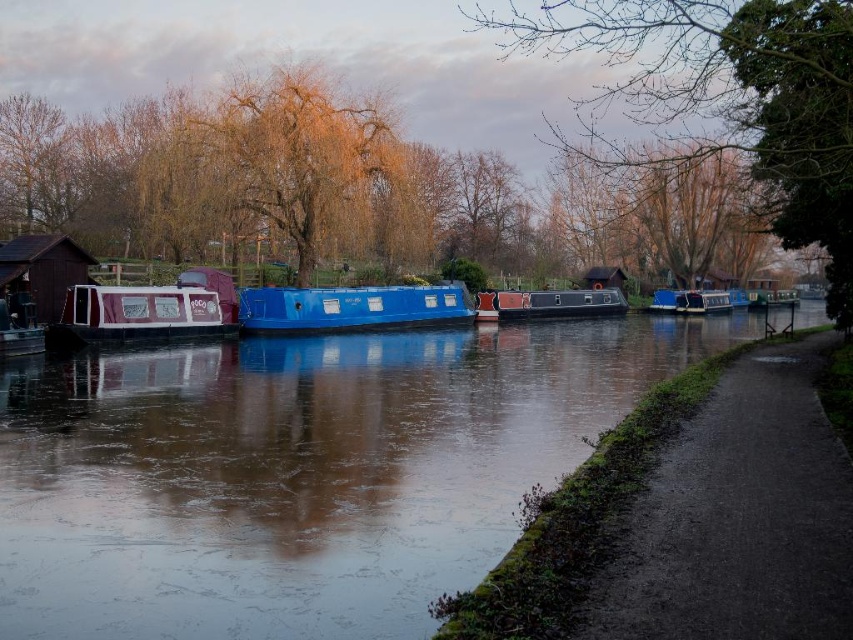
You are planning to load a large cargo onto the maroon fabric boat at left and the blue glossy boat at center. Based on their sizes, which boat can accommodate more cargo?

The blue glossy boat at center can accommodate more cargo since it is larger than the maroon fabric boat at left.